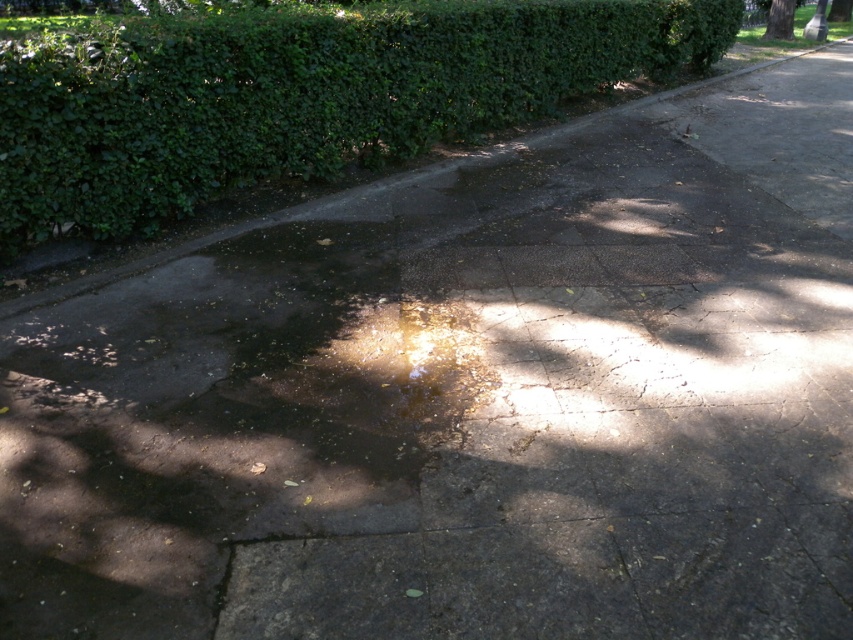
Question: Which point is farther to the camera?

Choices:
 (A) (775, 35)
 (B) (4, 177)

Answer: (A)

Question: Is green leafy hedge at upper left above green leafy tree at upper right?

Choices:
 (A) no
 (B) yes

Answer: (A)

Question: Among these points, which one is nearest to the camera?

Choices:
 (A) (770, 1)
 (B) (32, 216)

Answer: (B)

Question: Does green leafy hedge at upper left appear on the right side of green leafy tree at upper right?

Choices:
 (A) no
 (B) yes

Answer: (A)

Question: Does green leafy hedge at upper left have a greater width compared to green leafy tree at upper right?

Choices:
 (A) no
 (B) yes

Answer: (B)